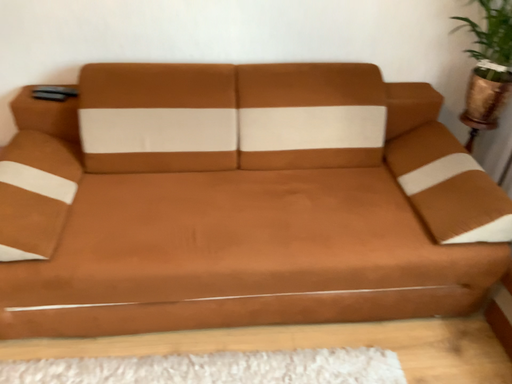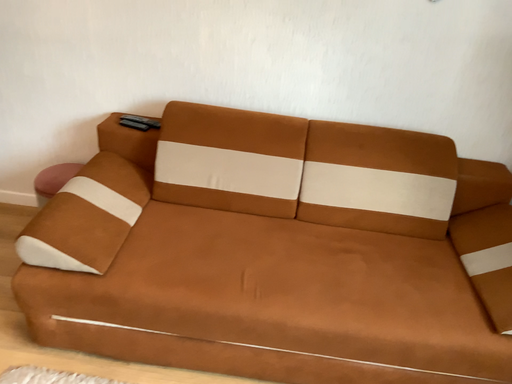
Question: Which way did the camera rotate in the video?

Choices:
 (A) rotated left
 (B) rotated right

Answer: (A)